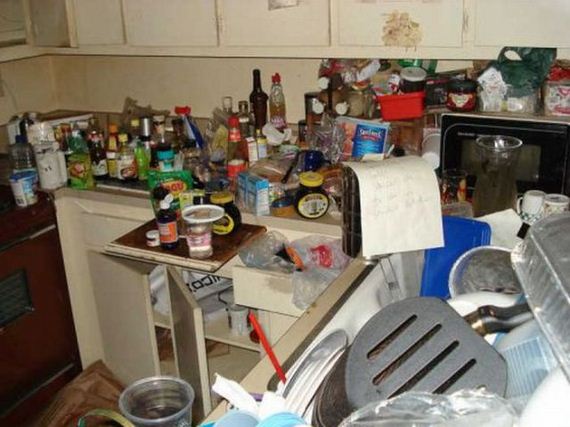
At what (x,y) coordinates should I click in order to perform the action: click on open top plastic container. Please return your answer as a coordinate pair (x, y). Looking at the image, I should click on (149, 396).